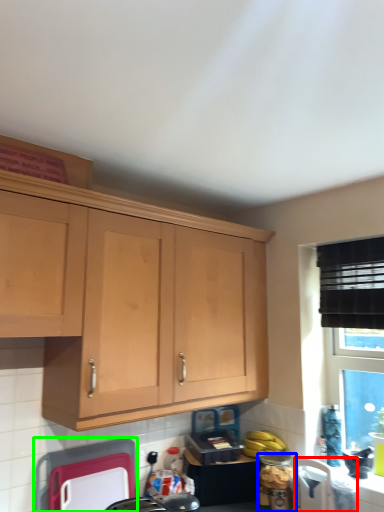
Question: Which object is positioned farthest from appliance (highlighted by a red box)? Select from appliance (highlighted by a blue box) and appliance (highlighted by a green box).

Choices:
 (A) appliance
 (B) appliance

Answer: (B)